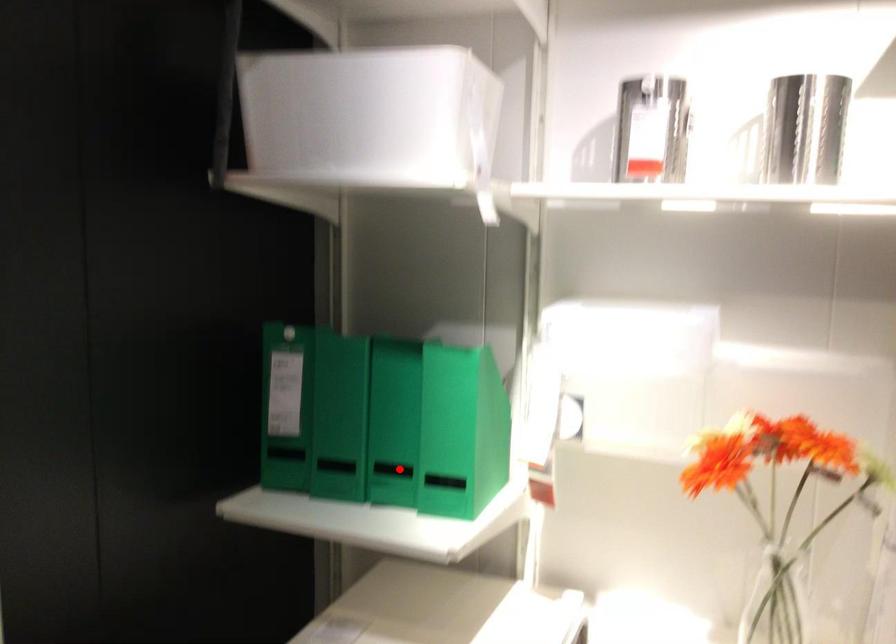
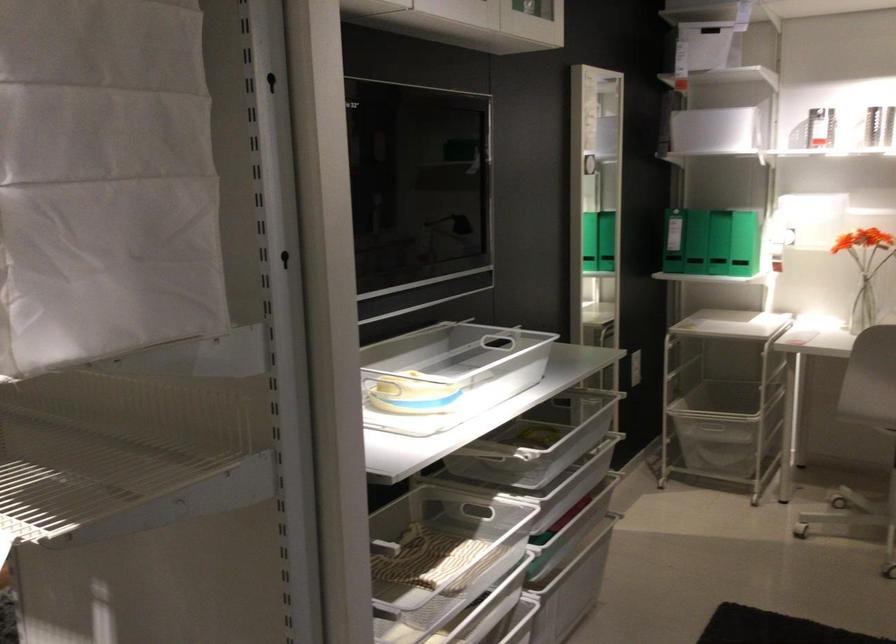
The point at the highlighted location is marked in the first image. Where is the corresponding point in the second image?

(745, 243)